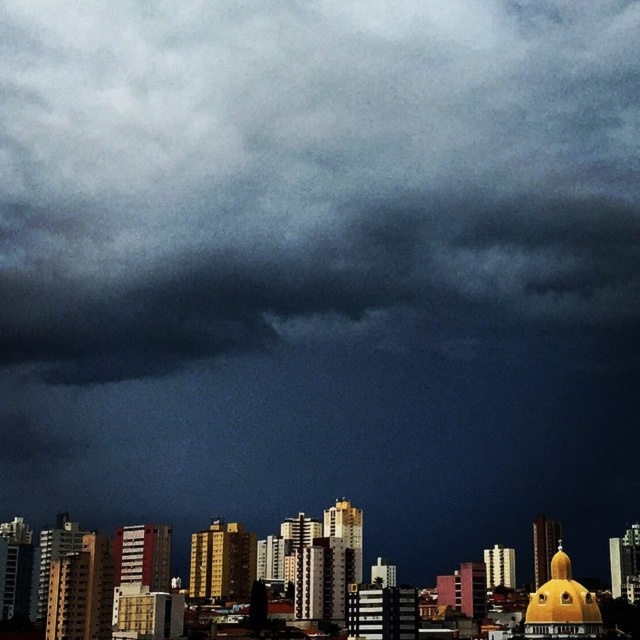
Looking at this image, you are an architect analyzing the stormy sky in the image. You need to determine which dark gray cloud is smaller in size between the dark gray cloud at upper center and the dark gray cloud at center. Which one should you report as the smaller one?

The dark gray cloud at upper center is smaller in size than the dark gray cloud at center because it occupies less space.

You are an architect observing the stormy skyline. You need to determine the spatial relationship between the dark gray cloud at upper center and the dark gray cloud at center. Which cloud is closer to you?

The dark gray cloud at upper center is closer to you because it is in front of the dark gray cloud at center, which is positioned behind it.

You are an airplane pilot preparing for landing and notice two dark gray clouds in the sky. You see the dark gray cloud at upper center and the dark gray cloud at center. Which cloud is positioned more to the right side of the sky?

The dark gray cloud at upper center is positioned more to the right side of the sky compared to the dark gray cloud at center.